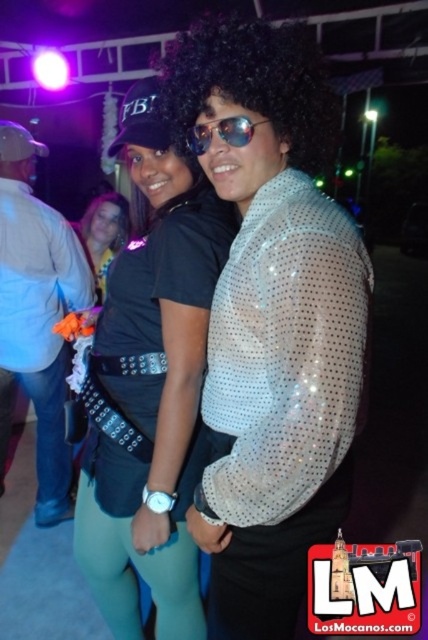
Question: Is brushed metal belt at left positioned before black curly hair at center?

Choices:
 (A) no
 (B) yes

Answer: (B)

Question: Is black curly wig at center smaller than matte black top at center?

Choices:
 (A) no
 (B) yes

Answer: (B)

Question: Which object is farther from the camera taking this photo?

Choices:
 (A) sunglasses at center
 (B) black curly hair at center
 (C) teal spandex leggings at lower center

Answer: (B)

Question: Is shiny sequined shirt at center above matte black shirt at center?

Choices:
 (A) yes
 (B) no

Answer: (A)

Question: Which of the following is the closest to the observer?

Choices:
 (A) matte black top at center
 (B) shiny sequined shirt at center
 (C) sunglasses at center
 (D) teal spandex leggings at lower center

Answer: (B)

Question: Which point is closer to the camera?

Choices:
 (A) brushed metal belt at left
 (B) black curly hair at center
 (C) matte black top at center
 (D) sunglasses at center

Answer: (D)